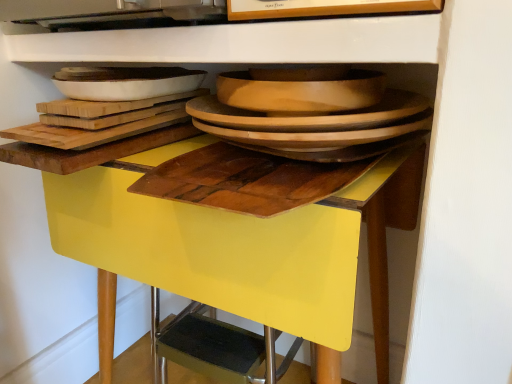
The width and height of the screenshot is (512, 384). What are the coordinates of `vacant space underneath wooden cutting board at center (from a real-world perspective)` in the screenshot? It's located at (246, 168).